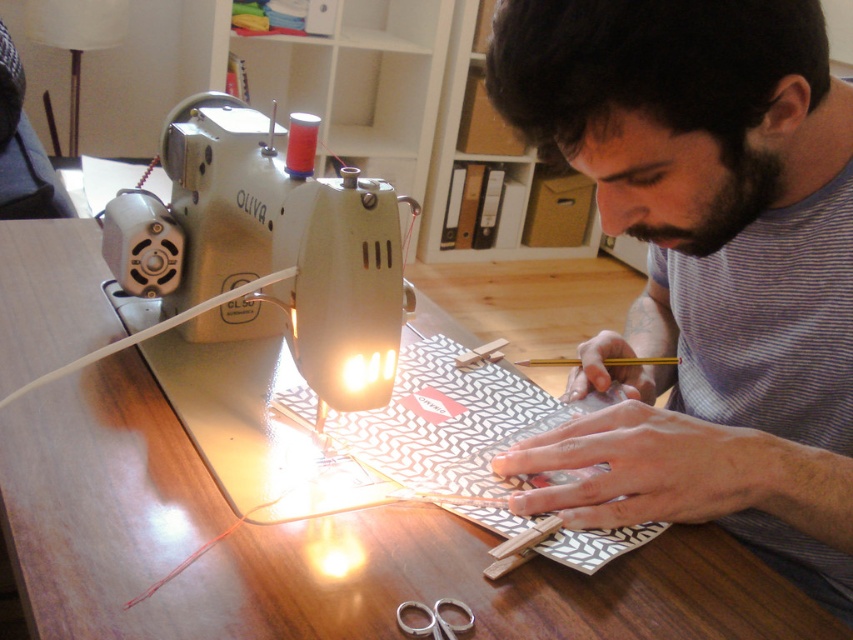
Does point (242, 600) come farther from viewer compared to point (457, 364)?

No, (242, 600) is closer to viewer.

Who is lower down, wooden table at center or wooden ruler at center?

Positioned lower is wooden table at center.

Between point (283, 570) and point (492, 344), which one is positioned behind?

Positioned behind is point (492, 344).

At what (x,y) coordinates should I click in order to perform the action: click on wooden table at center. Please return your answer as a coordinate pair (x, y). Looking at the image, I should click on (311, 547).

Does striped cotton shirt at center appear on the left side of silver metallic scissors at lower center?

In fact, striped cotton shirt at center is to the right of silver metallic scissors at lower center.

Find the location of a particular element. The image size is (853, 640). striped cotton shirt at center is located at coordinates (704, 264).

Who is more forward, (x=641, y=312) or (x=469, y=627)?

Positioned in front is point (x=469, y=627).

You are a GUI agent. You are given a task and a screenshot of the screen. Output one action in this format:
    pyautogui.click(x=<x>, y=<y>)
    Task: Click on the striped cotton shirt at center
    This screenshot has height=640, width=853.
    Given the screenshot: What is the action you would take?
    pos(704,264)

Who is positioned more to the right, wooden table at center or silver metallic scissors at lower center?

silver metallic scissors at lower center is more to the right.

Can you confirm if wooden table at center is bigger than silver metallic scissors at lower center?

Yes.

Who is more distant from viewer, (155, 451) or (433, 634)?

The point (155, 451) is more distant.

Image resolution: width=853 pixels, height=640 pixels. Find the location of `wooden table at center`. wooden table at center is located at coordinates (311, 547).